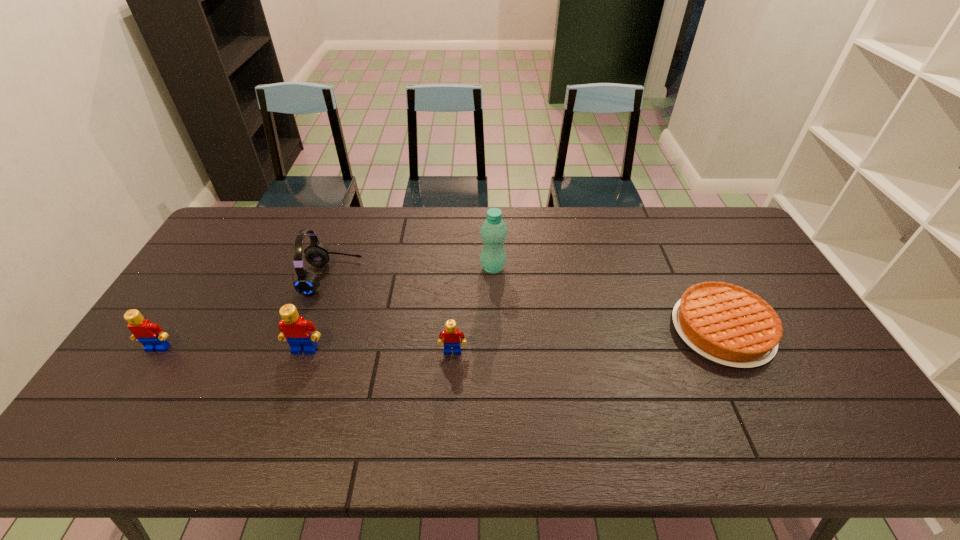
Identify the location of the leftmost object. (151, 335).

The height and width of the screenshot is (540, 960). Find the location of `the leftmost Lego`. the leftmost Lego is located at coordinates (151, 335).

Where is `the second Lego from right to left`? The width and height of the screenshot is (960, 540). the second Lego from right to left is located at coordinates (295, 329).

You are a GUI agent. You are given a task and a screenshot of the screen. Output one action in this format:
    pyautogui.click(x=<x>, y=<y>)
    Task: Click on the shortest Lego
    
    Given the screenshot: What is the action you would take?
    pyautogui.click(x=451, y=336)

Find the location of a particular element. The width and height of the screenshot is (960, 540). the fifth tallest object is located at coordinates (451, 336).

The height and width of the screenshot is (540, 960). What are the coordinates of `the shortest object` in the screenshot? It's located at (727, 324).

What are the coordinates of `the rightmost object` in the screenshot? It's located at [727, 324].

I want to click on the second object from right to left, so click(x=493, y=231).

Where is `bottle`? The image size is (960, 540). bottle is located at coordinates (493, 231).

This screenshot has width=960, height=540. I want to click on headset, so click(306, 282).